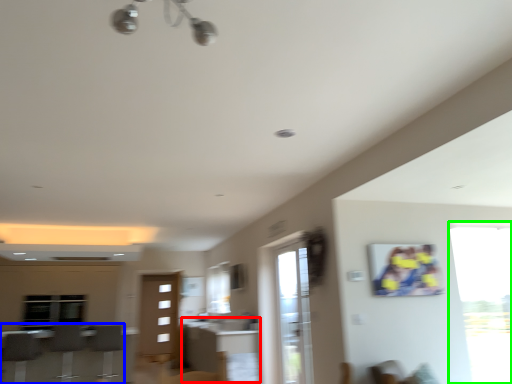
Question: Considering the real-world distances, which object is farthest from table (highlighted by a red box)? furniture (highlighted by a blue box) or window (highlighted by a green box)?

Choices:
 (A) furniture
 (B) window

Answer: (B)